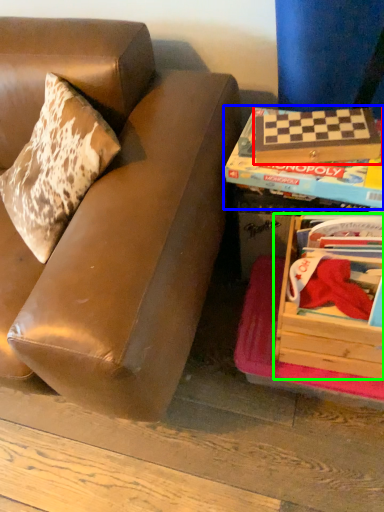
Question: Considering the real-world distances, which object is farthest from paperback book (highlighted by a red box)? paperback book (highlighted by a blue box) or box (highlighted by a green box)?

Choices:
 (A) paperback book
 (B) box

Answer: (B)